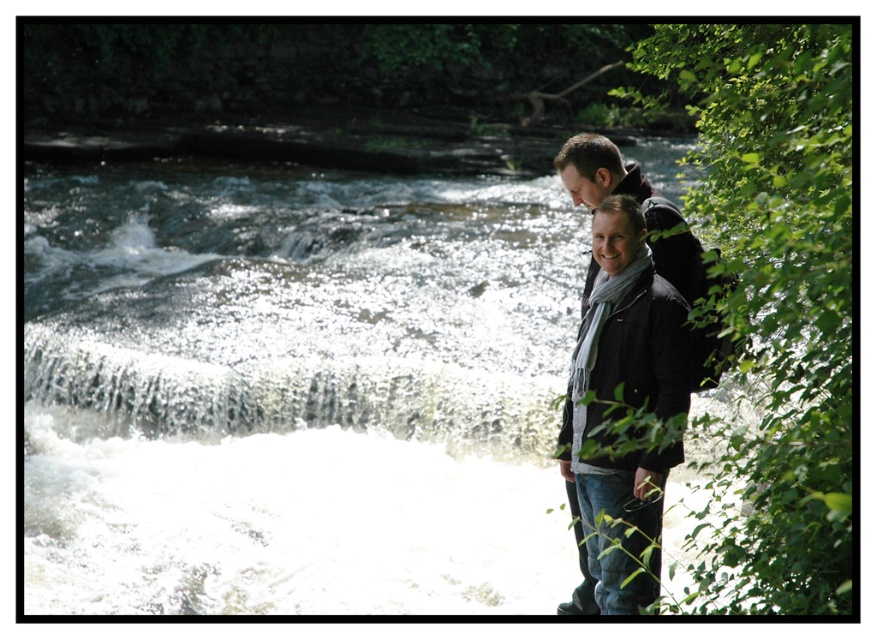
You are planning to cross the river using a small raft that can only carry items up to 1 meter in width. You see the white frothy water at center and the matte black jacket at right in the scene. Can the raft safely carry both items across the river without exceeding its width limit?

The white frothy water at center might be wider than matte black jacket at right, so there is a possibility that the raft cannot safely carry both items across the river without exceeding its width limit.

You are a photographer trying to capture the white frothy water at center and the matte black jacket at right in the same frame. Based on their positions, which object is closer to the left edge of the image?

The matte black jacket at right is closer to the left edge of the image because the white frothy water at center is positioned on the right side of it.